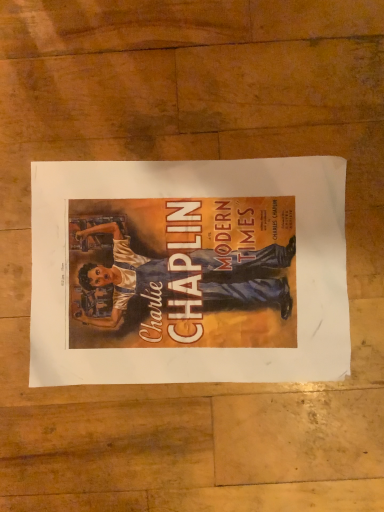
What do you see at coordinates (189, 272) in the screenshot?
I see `matte paper poster at center` at bounding box center [189, 272].

You are a GUI agent. You are given a task and a screenshot of the screen. Output one action in this format:
    pyautogui.click(x=<x>, y=<y>)
    Task: Click on the matte paper poster at center
    The image size is (384, 512).
    Given the screenshot: What is the action you would take?
    pyautogui.click(x=189, y=272)

Find the location of a particular element. The height and width of the screenshot is (512, 384). matte paper poster at center is located at coordinates (189, 272).